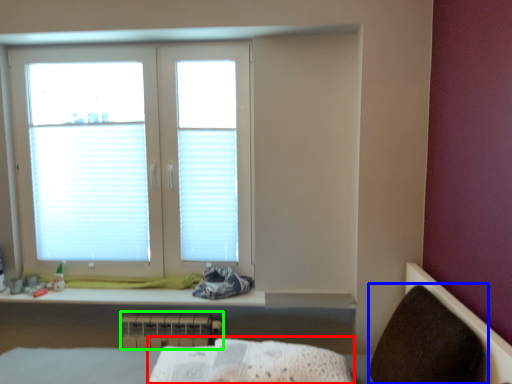
Question: Considering the real-world distances, which object is closest to sheet (highlighted by a red box)? armchair (highlighted by a blue box) or radiator (highlighted by a green box).

Choices:
 (A) armchair
 (B) radiator

Answer: (A)